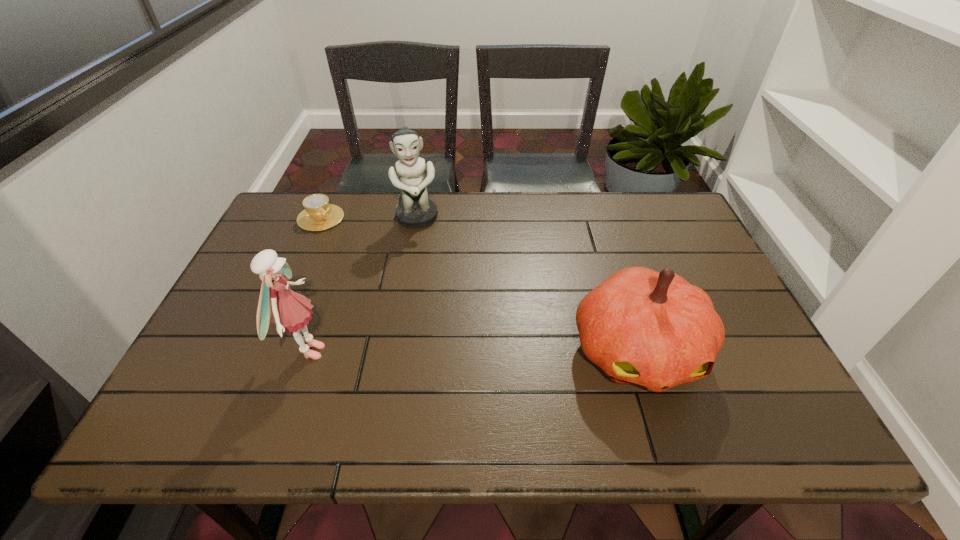
The width and height of the screenshot is (960, 540). Identify the location of blank area located 0.300m with the handle on the side of the cup. (378, 285).

Where is `free region located with the handle on the side of the cup`? The width and height of the screenshot is (960, 540). free region located with the handle on the side of the cup is located at coordinates (339, 239).

The width and height of the screenshot is (960, 540). In order to click on figurine that is at the far edge in this screenshot , I will do `click(416, 211)`.

Identify the location of cup that is at the far edge. The image size is (960, 540). (318, 215).

Find the location of a particular element. This screenshot has height=540, width=960. doll at the near edge is located at coordinates (290, 311).

This screenshot has width=960, height=540. Find the location of `pumpkin located at the near edge`. pumpkin located at the near edge is located at coordinates (653, 329).

Image resolution: width=960 pixels, height=540 pixels. Identify the location of object located at the left edge. (318, 215).

This screenshot has width=960, height=540. I want to click on object located at the right edge, so click(x=653, y=329).

Identify the location of object located in the far left corner section of the desktop. (318, 215).

Where is `object situated at the near right corner`? The image size is (960, 540). object situated at the near right corner is located at coordinates (653, 329).